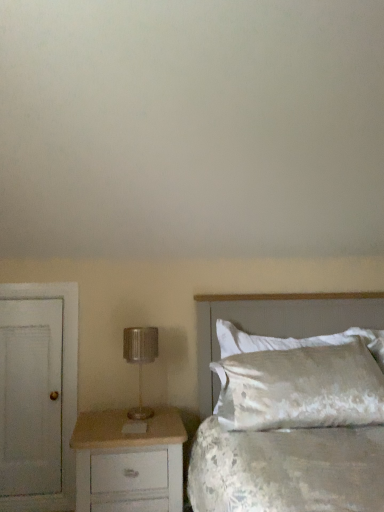
Question: Is white matte door at left turned away from satin white pillow at right?

Choices:
 (A) yes
 (B) no

Answer: (B)

Question: Can you confirm if white matte door at left is bigger than satin white pillow at right?

Choices:
 (A) yes
 (B) no

Answer: (B)

Question: Is white matte door at left not close to satin white pillow at right?

Choices:
 (A) no
 (B) yes

Answer: (B)

Question: Does white matte door at left lie in front of satin white pillow at right?

Choices:
 (A) no
 (B) yes

Answer: (A)

Question: Is white matte door at left wider than satin white pillow at right?

Choices:
 (A) yes
 (B) no

Answer: (B)

Question: From the image's perspective, is white matte door at left above or below white painted wood chest of drawers at lower left?

Choices:
 (A) above
 (B) below

Answer: (A)

Question: Based on their sizes in the image, would you say white matte door at left is bigger or smaller than white painted wood chest of drawers at lower left?

Choices:
 (A) small
 (B) big

Answer: (A)

Question: In terms of width, does white matte door at left look wider or thinner when compared to white painted wood chest of drawers at lower left?

Choices:
 (A) thin
 (B) wide

Answer: (A)

Question: Would you say white matte door at left is to the left or to the right of white painted wood chest of drawers at lower left in the picture?

Choices:
 (A) right
 (B) left

Answer: (B)

Question: In the image, is satin white pillow at right positioned in front of or behind white matte door at left?

Choices:
 (A) front
 (B) behind

Answer: (A)

Question: From the image's perspective, relative to white matte door at left, is satin white pillow at right above or below?

Choices:
 (A) below
 (B) above

Answer: (B)

Question: Based on their sizes in the image, would you say satin white pillow at right is bigger or smaller than white matte door at left?

Choices:
 (A) big
 (B) small

Answer: (A)

Question: From a real-world perspective, is satin white pillow at right physically located above or below white matte door at left?

Choices:
 (A) above
 (B) below

Answer: (A)

Question: From their relative heights in the image, would you say white painted wood chest of drawers at lower left is taller or shorter than satin white bed at right?

Choices:
 (A) short
 (B) tall

Answer: (A)

Question: Is white painted wood chest of drawers at lower left inside or outside of satin white bed at right?

Choices:
 (A) outside
 (B) inside

Answer: (A)